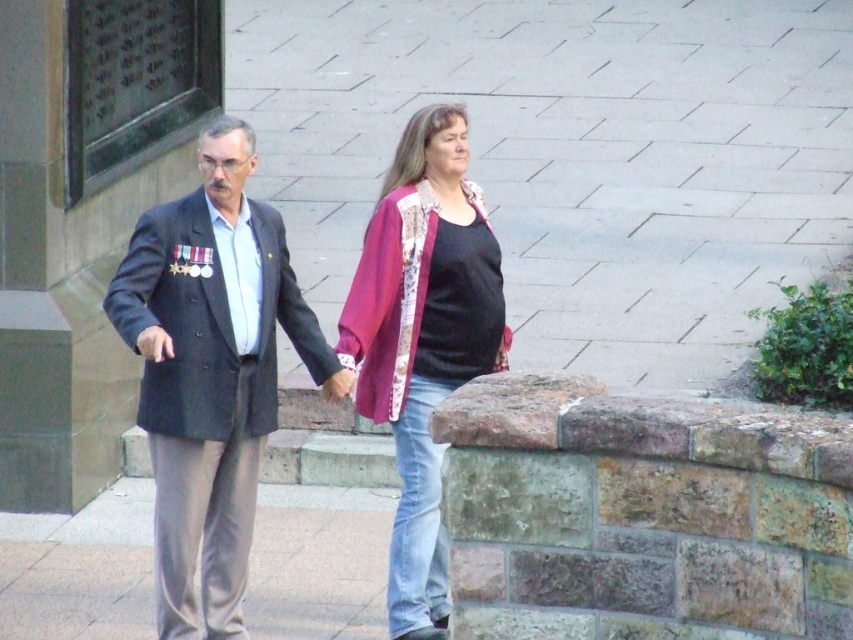
You are a photographer trying to capture a clear photo of both the dark gray suit at center and the rustic patchwork cardigan at center. Since you can only focus on one object at a time, which one should you choose to ensure the other is still somewhat in focus?

The dark gray suit at center is closer to the viewer than the rustic patchwork cardigan at center. To ensure both are somewhat in focus, focus on the dark gray suit at center because it is closer, and the depth of field will extend to the farther object.

In the scene shown: You are standing in front of the two people walking on the paved area. You want to place a small flower pot exactly halfway between point (201,595) and point (370,352). Will the flower pot be closer to the man or the woman?

The flower pot placed halfway between point (201,595) and point (370,352) will be closer to the man because point (201,595) is closer to the viewer than point (370,352).